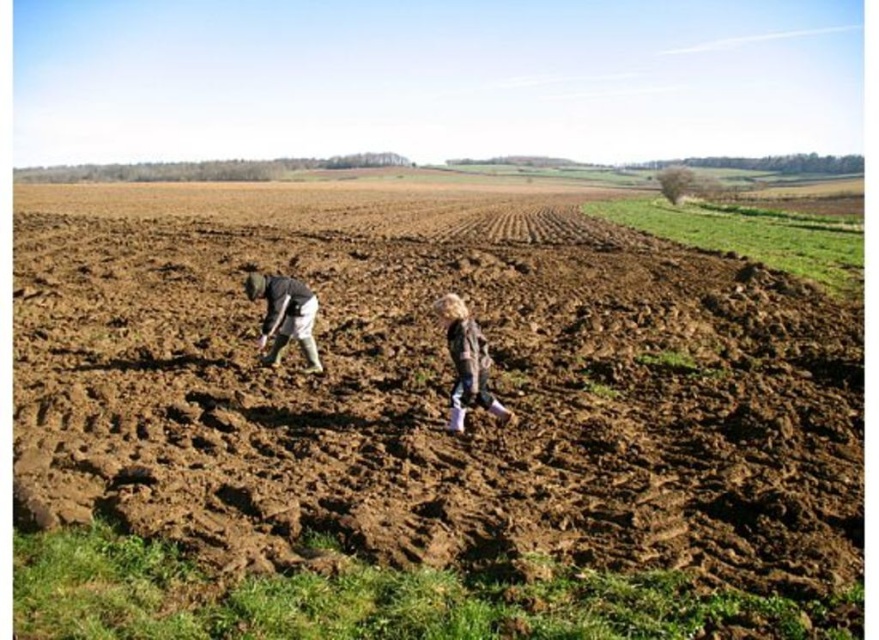
Does brown soil at center appear on the left side of light brown fabric jacket at center?

Indeed, brown soil at center is positioned on the left side of light brown fabric jacket at center.

Is brown soil at center in front of light brown fabric jacket at center?

Yes, brown soil at center is closer to the viewer.

Who is more distant from viewer, (18, 212) or (449, 401)?

Point (18, 212)

You are a GUI agent. You are given a task and a screenshot of the screen. Output one action in this format:
    pyautogui.click(x=<x>, y=<y>)
    Task: Click on the brown soil at center
    The width and height of the screenshot is (879, 640).
    Given the screenshot: What is the action you would take?
    (423, 420)

Can you confirm if brown soil at center is wider than dark gray fabric at lower left?

Correct, the width of brown soil at center exceeds that of dark gray fabric at lower left.

Between point (201, 516) and point (309, 342), which one is positioned in front?

Point (201, 516) is more forward.

I want to click on brown soil at center, so pyautogui.click(x=423, y=420).

Does light brown fabric jacket at center appear on the left side of dark gray fabric at lower left?

In fact, light brown fabric jacket at center is to the right of dark gray fabric at lower left.

Is light brown fabric jacket at center smaller than dark gray fabric at lower left?

Indeed, light brown fabric jacket at center has a smaller size compared to dark gray fabric at lower left.

What do you see at coordinates (466, 362) in the screenshot? The width and height of the screenshot is (879, 640). I see `light brown fabric jacket at center` at bounding box center [466, 362].

At what (x,y) coordinates should I click in order to perform the action: click on light brown fabric jacket at center. Please return your answer as a coordinate pair (x, y). Looking at the image, I should click on (466, 362).